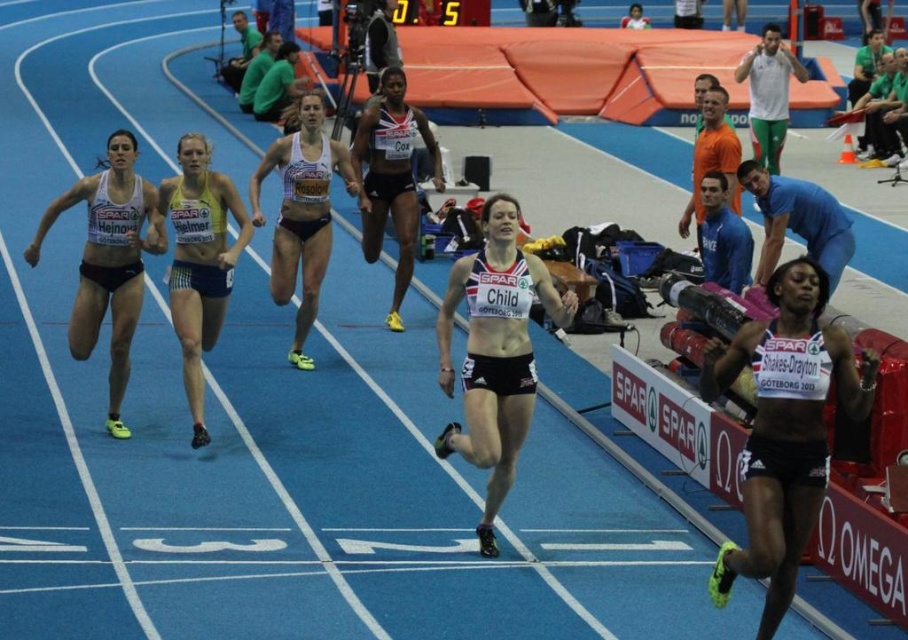
Question: Is black matte shorts at center above blue cotton shirt at upper right?

Choices:
 (A) no
 (B) yes

Answer: (B)

Question: Which point appears farthest from the camera in this image?

Choices:
 (A) (127, 193)
 (B) (755, 163)
 (C) (416, 234)

Answer: (C)

Question: Is black matte shorts at right thinner than blue cotton shirt at upper right?

Choices:
 (A) no
 (B) yes

Answer: (B)

Question: Which point is farther from the camera taking this photo?

Choices:
 (A) (517, 310)
 (B) (136, 307)

Answer: (B)

Question: Considering the relative positions of matte black shorts at center and matte white tank top at left in the image provided, where is matte black shorts at center located with respect to matte white tank top at left?

Choices:
 (A) left
 (B) right

Answer: (B)

Question: Which of the following is the closest to the observer?

Choices:
 (A) black matte shorts at center
 (B) yellow mesh tank top at center
 (C) matte white tank top at left

Answer: (B)